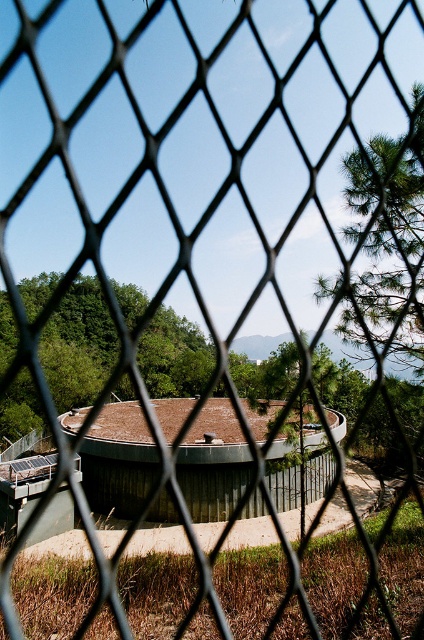
Question: Which point is farther to the camera?

Choices:
 (A) (139, 454)
 (B) (413, 321)

Answer: (A)

Question: Does concrete wall at center appear over green textured pine tree at upper right?

Choices:
 (A) no
 (B) yes

Answer: (A)

Question: Can you confirm if concrete wall at center is bigger than green textured pine tree at upper right?

Choices:
 (A) no
 (B) yes

Answer: (B)

Question: Does concrete wall at center have a smaller size compared to green textured pine tree at upper right?

Choices:
 (A) yes
 (B) no

Answer: (B)